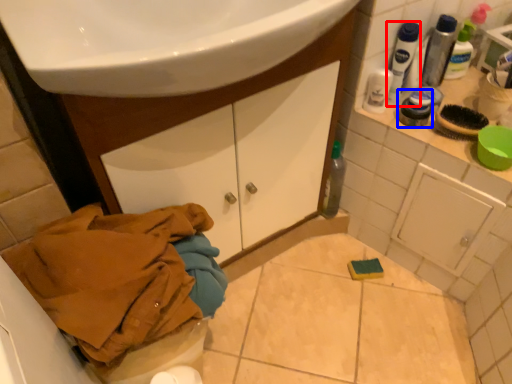
Question: Which of the following is the farthest to the observer, mouthwash (highlighted by a red box) or toiletry (highlighted by a blue box)?

Choices:
 (A) mouthwash
 (B) toiletry

Answer: (B)